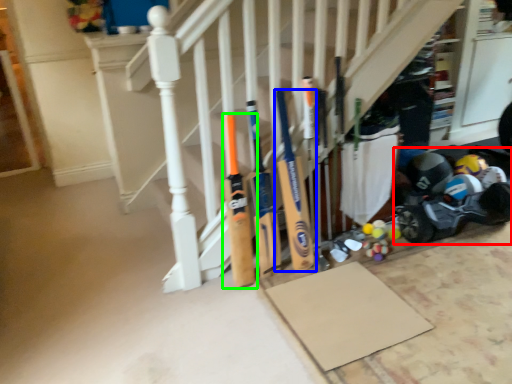
Question: Considering the real-world distances, which object is closest to baby carriage (highlighted by a red box)? baseball bat (highlighted by a blue box) or baseball bat (highlighted by a green box).

Choices:
 (A) baseball bat
 (B) baseball bat

Answer: (A)